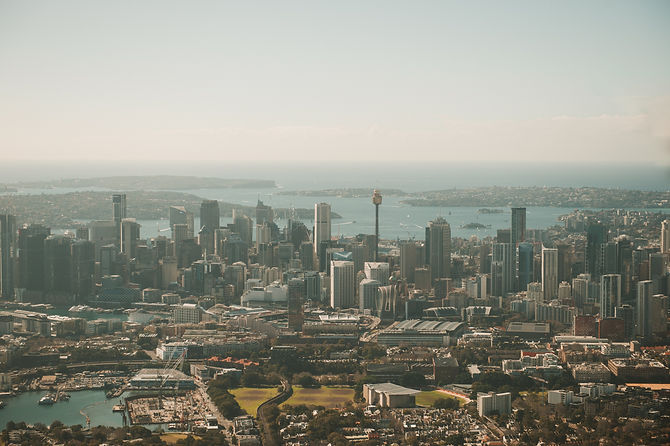
Find the location of a particular element. The width and height of the screenshot is (670, 446). apartments is located at coordinates (500, 398).